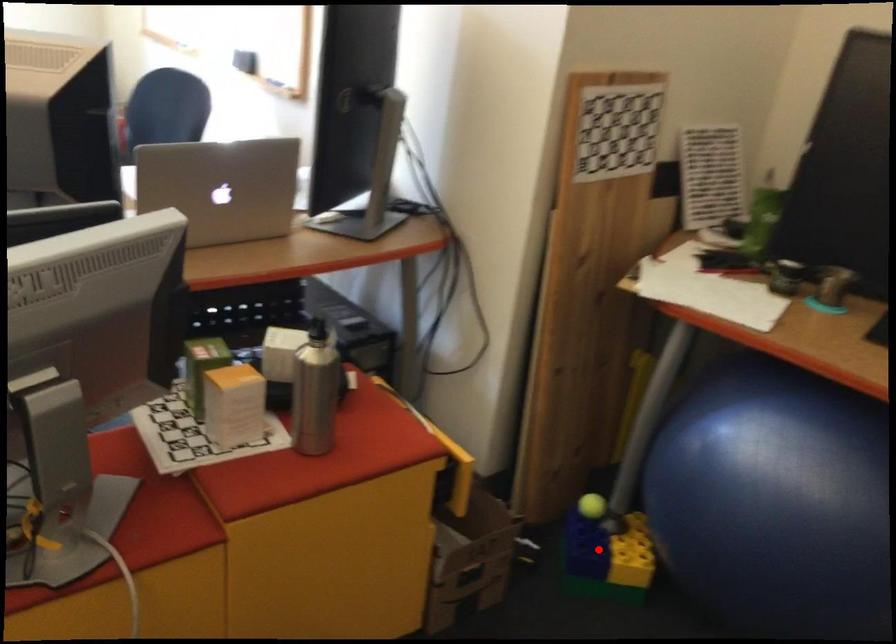
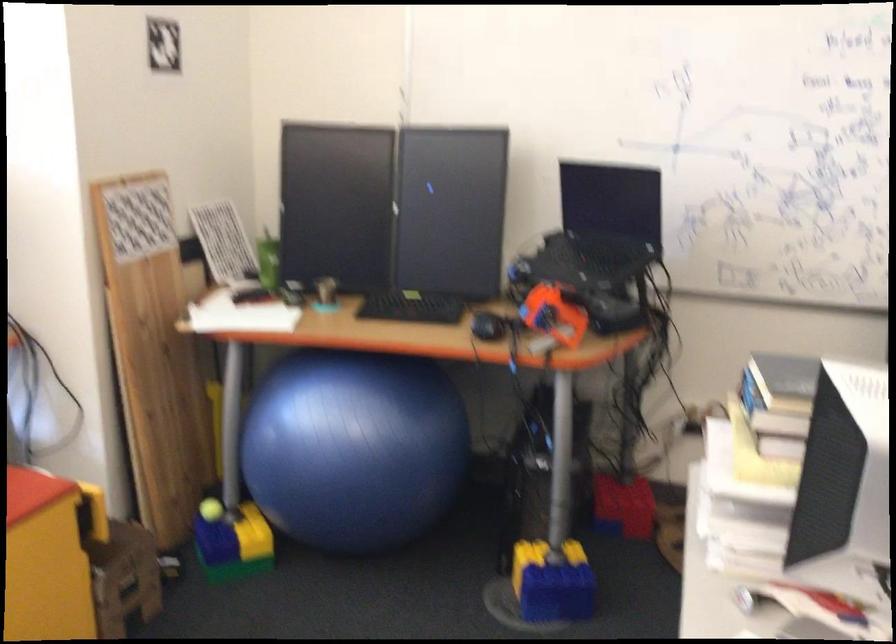
The point at the highlighted location is marked in the first image. Where is the corresponding point in the second image?

(231, 534)